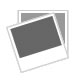
The image size is (80, 80). In order to click on picture area in this screenshot , I will do `click(41, 33)`, `click(61, 28)`.